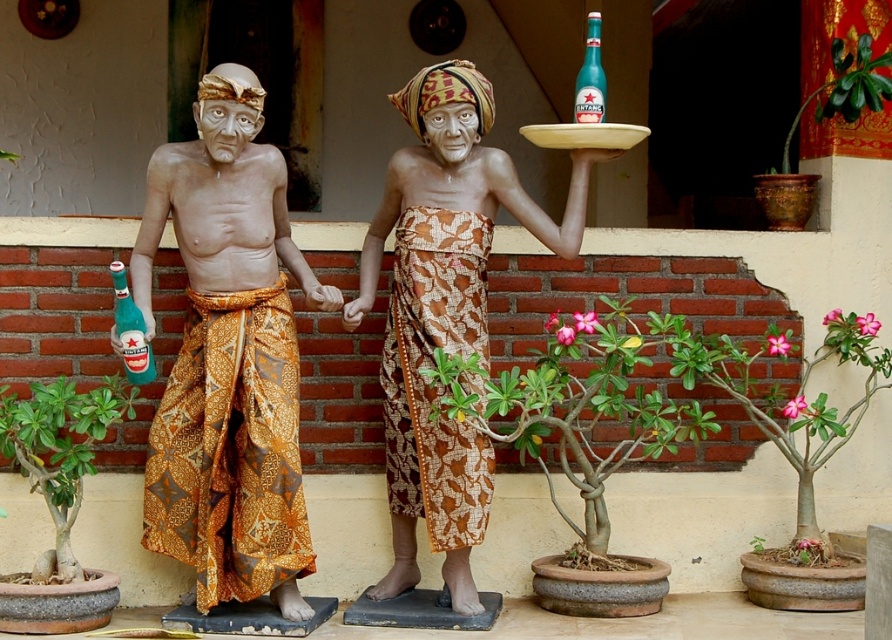
Question: Among these objects, which one is farthest from the camera?

Choices:
 (A) green glass bottle at left
 (B) teal glass beer bottle at upper center
 (C) matte clay face at center
 (D) batik fabric statue at center

Answer: (D)

Question: Can you confirm if matte clay face at center is positioned to the right of teal glass beer bottle at upper center?

Choices:
 (A) no
 (B) yes

Answer: (A)

Question: Estimate the real-world distances between objects in this image. Which object is closer to the teal glass beer bottle at upper center?

Choices:
 (A) matte brown statue at center
 (B) batik fabric statue at center
 (C) green glass bottle at left

Answer: (A)

Question: Is matte brown statue at center bigger than teal glass beer bottle at upper center?

Choices:
 (A) yes
 (B) no

Answer: (B)

Question: Which point is closer to the camera?

Choices:
 (A) matte orange batik sarong at left
 (B) teal glass beer bottle at upper center

Answer: (B)

Question: Can you confirm if matte clay face at center is positioned to the right of green glass bottle at left?

Choices:
 (A) no
 (B) yes

Answer: (B)